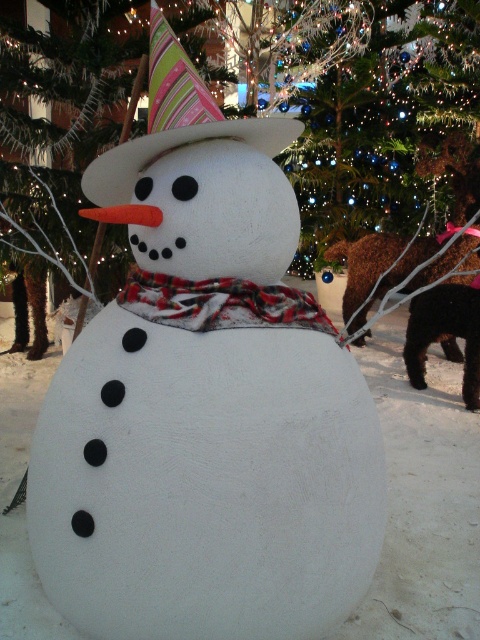
Question: Which of these objects is positioned closest to the green glittery christmas tree at center?

Choices:
 (A) plaid fabric scarf at center
 (B) white matte snowman at center

Answer: (B)

Question: Considering the real-world distances, which object is closest to the plaid fabric scarf at center?

Choices:
 (A) striped fabric party hat at upper center
 (B) green glittery christmas tree at center

Answer: (A)

Question: Which of the following is the farthest from the observer?

Choices:
 (A) green glittery christmas tree at center
 (B) white matte snowman at center
 (C) plaid fabric scarf at center

Answer: (A)

Question: Is green glittery christmas tree at center to the right of plaid fabric scarf at center from the viewer's perspective?

Choices:
 (A) no
 (B) yes

Answer: (B)

Question: Is white matte snowman at center positioned before striped fabric party hat at upper center?

Choices:
 (A) no
 (B) yes

Answer: (A)

Question: Is white matte snowman at center below green glittery christmas tree at center?

Choices:
 (A) yes
 (B) no

Answer: (A)